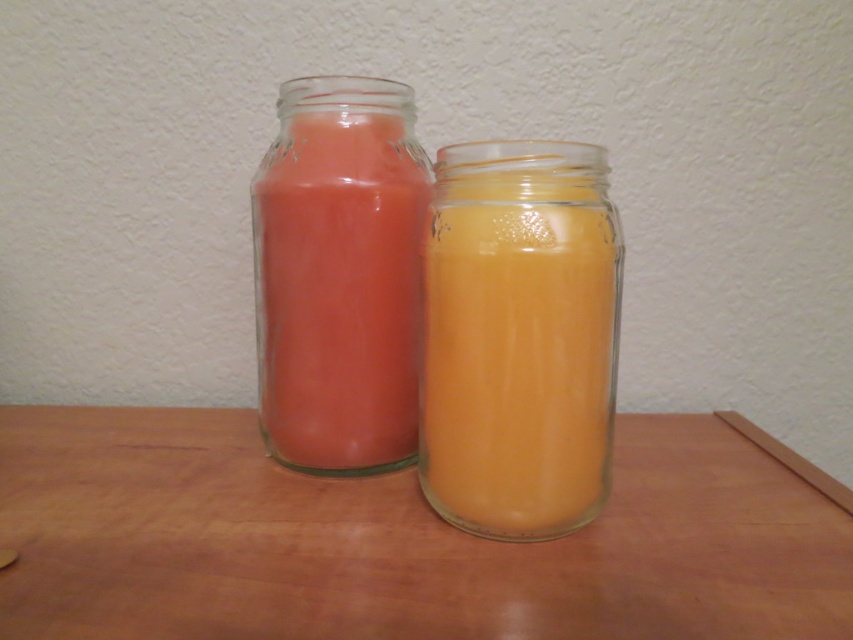
Question: Is wooden table at center bigger than matte glass jar at center?

Choices:
 (A) no
 (B) yes

Answer: (B)

Question: Which object is closer to the camera taking this photo?

Choices:
 (A) wooden table at center
 (B) matte glass jar at center

Answer: (A)

Question: Which object is the closest to the translucent glass candle at center?

Choices:
 (A) matte glass jar at center
 (B) wooden table at center

Answer: (A)

Question: Among these objects, which one is farthest from the camera?

Choices:
 (A) wooden table at center
 (B) translucent glass candle at center
 (C) matte glass jar at center

Answer: (C)

Question: Is wooden table at center bigger than matte glass jar at center?

Choices:
 (A) yes
 (B) no

Answer: (A)

Question: Observing the image, what is the correct spatial positioning of wooden table at center in reference to translucent glass candle at center?

Choices:
 (A) above
 (B) below

Answer: (B)